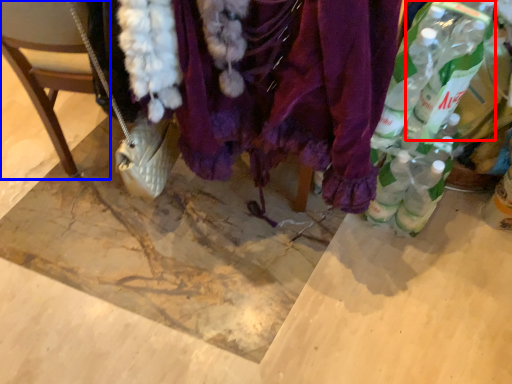
Question: Which object appears farthest to the camera in this image, bottle (highlighted by a red box) or chair (highlighted by a blue box)?

Choices:
 (A) bottle
 (B) chair

Answer: (A)